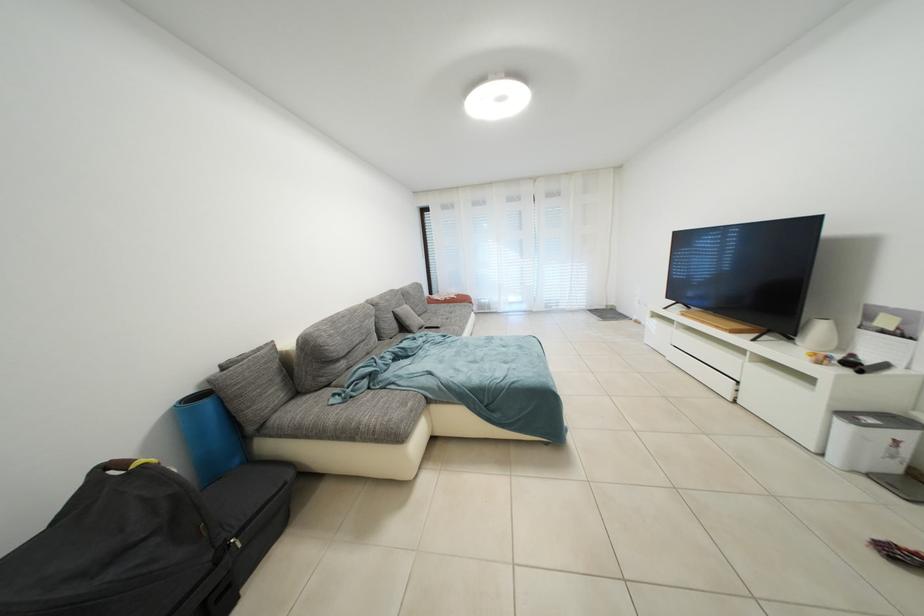
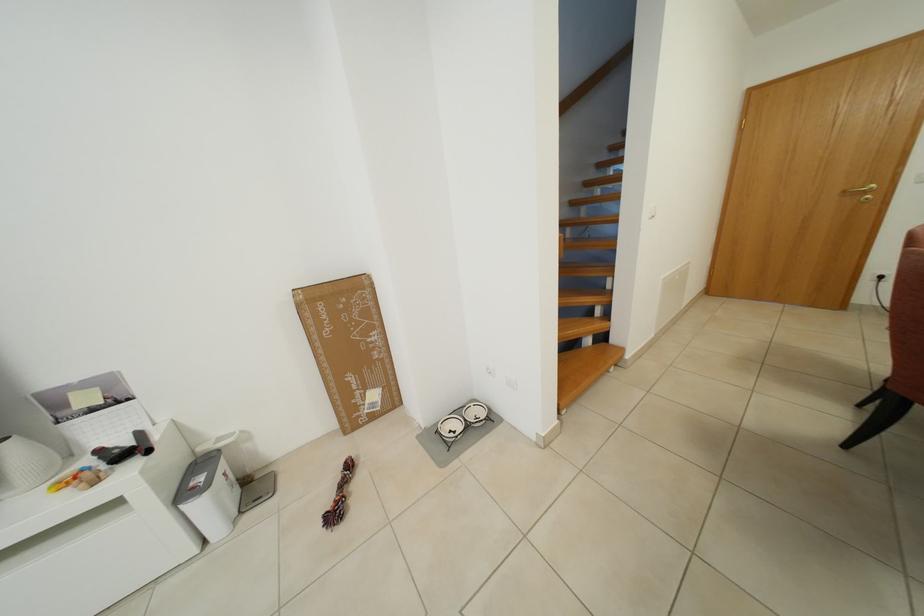
In the second image, find the point that corresponds to (x=880, y=426) in the first image.

(208, 484)